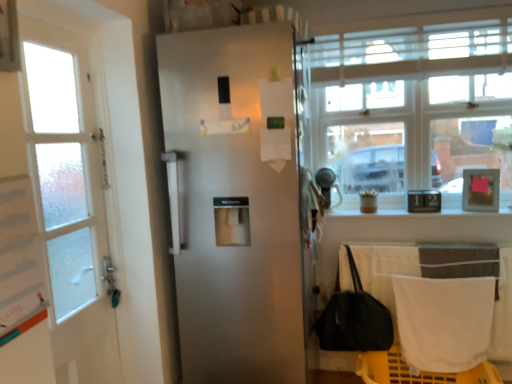
Question: Does satin white refrigerator at center have a greater width compared to clear glass window at upper right?

Choices:
 (A) no
 (B) yes

Answer: (B)

Question: From a real-world perspective, is satin white refrigerator at center physically above clear glass window at upper right?

Choices:
 (A) no
 (B) yes

Answer: (A)

Question: Does satin white refrigerator at center contain clear glass window at upper right?

Choices:
 (A) yes
 (B) no

Answer: (B)

Question: From a real-world perspective, is satin white refrigerator at center positioned under clear glass window at upper right based on gravity?

Choices:
 (A) yes
 (B) no

Answer: (A)

Question: Can you confirm if satin white refrigerator at center is taller than clear glass window at upper right?

Choices:
 (A) no
 (B) yes

Answer: (B)

Question: Is satin white refrigerator at center to the right of clear glass window at upper right from the viewer's perspective?

Choices:
 (A) yes
 (B) no

Answer: (B)

Question: Considering the relative sizes of clear glass window at upper right and white fabric towel at lower right in the image provided, is clear glass window at upper right thinner than white fabric towel at lower right?

Choices:
 (A) no
 (B) yes

Answer: (A)

Question: Can you confirm if clear glass window at upper right is bigger than white fabric towel at lower right?

Choices:
 (A) yes
 (B) no

Answer: (A)

Question: Are clear glass window at upper right and white fabric towel at lower right located far from each other?

Choices:
 (A) no
 (B) yes

Answer: (A)

Question: Is clear glass window at upper right to the left of white fabric towel at lower right from the viewer's perspective?

Choices:
 (A) no
 (B) yes

Answer: (B)

Question: Does clear glass window at upper right contain white fabric towel at lower right?

Choices:
 (A) yes
 (B) no

Answer: (B)

Question: From the image's perspective, would you say clear glass window at upper right is shown under white fabric towel at lower right?

Choices:
 (A) no
 (B) yes

Answer: (A)

Question: Is clear glass window at upper right outside of black fabric handbag at lower right?

Choices:
 (A) yes
 (B) no

Answer: (A)